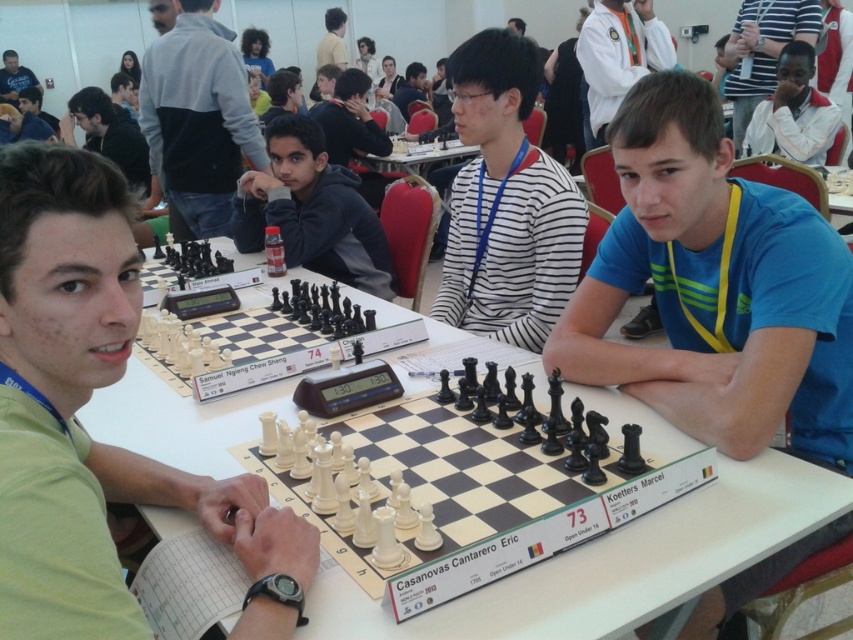
Question: Considering the real-world distances, which object is farthest from the matte black chess set at center?

Choices:
 (A) gray fleece jacket at upper left
 (B) white striped shirt at upper center
 (C) green matte shirt at center

Answer: (B)

Question: Is white plastic table at center below matte black chess set at center?

Choices:
 (A) yes
 (B) no

Answer: (A)

Question: Does green matte shirt at center have a smaller size compared to matte black shirt at upper left?

Choices:
 (A) no
 (B) yes

Answer: (B)

Question: Is gray fleece jacket at upper left behind white cotton shirt at upper center?

Choices:
 (A) yes
 (B) no

Answer: (B)

Question: Estimate the real-world distances between objects in this image. Which object is closer to the matte black shirt at upper left?

Choices:
 (A) gray fleece jacket at upper left
 (B) white striped shirt at upper center

Answer: (A)

Question: Which object is positioned farthest from the blue cotton shirt at center?

Choices:
 (A) gray fleece jacket at upper left
 (B) white plastic table at center
 (C) white striped shirt at upper center

Answer: (C)